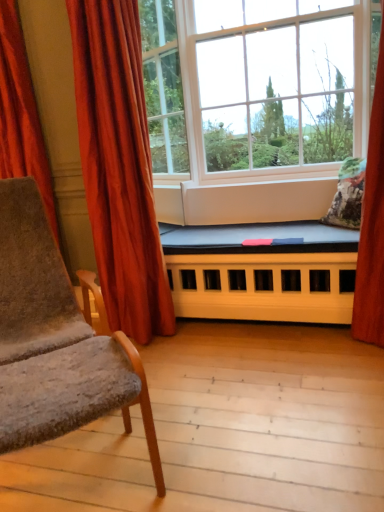
This screenshot has height=512, width=384. What do you see at coordinates (55, 340) in the screenshot?
I see `velvet gray armchair at left` at bounding box center [55, 340].

What is the approximate height of black fabric bed at center?

black fabric bed at center is 20.23 inches tall.

At what (x,y) coordinates should I click in order to perform the action: click on white plastic window at center, placed as the first window when sorted from right to left. Please return your answer as a coordinate pair (x, y). Looking at the image, I should click on click(256, 85).

Locate an element on the screen. The width and height of the screenshot is (384, 512). velvet gray armchair at left is located at coordinates (55, 340).

From the image's perspective, is velvet gray armchair at left above or below clear glass window at center, marked as the 1th window in a left-to-right arrangement?

velvet gray armchair at left is situated lower than clear glass window at center, marked as the 1th window in a left-to-right arrangement, in the image.

Is clear glass window at center, marked as the 2th window in a right-to-left arrangement, located within velvet gray armchair at left?

No, clear glass window at center, marked as the 2th window in a right-to-left arrangement, is not surrounded by velvet gray armchair at left.

Could you tell me if velvet gray armchair at left is facing clear glass window at center, marked as the 2th window in a right-to-left arrangement?

No, velvet gray armchair at left does not turn towards clear glass window at center, marked as the 2th window in a right-to-left arrangement.

From a real-world perspective, is velvet gray armchair at left positioned above or below clear glass window at center, marked as the 2th window in a right-to-left arrangement?

From a real-world perspective, velvet gray armchair at left is physically below clear glass window at center, marked as the 2th window in a right-to-left arrangement.

From a real-world perspective, who is located lower, fluffy floral pillow at right or velvet red curtain at left, which is counted as the first curtain, starting from the right?

fluffy floral pillow at right.

From the image's perspective, is fluffy floral pillow at right under velvet red curtain at left, which is counted as the first curtain, starting from the right?

Yes, from the image's perspective, fluffy floral pillow at right is below velvet red curtain at left, which is counted as the first curtain, starting from the right.

Between fluffy floral pillow at right and velvet red curtain at left, the second curtain in the left-to-right sequence, which one appears on the right side from the viewer's perspective?

fluffy floral pillow at right is more to the right.

Between fluffy floral pillow at right and velvet red curtain at left, which is counted as the first curtain, starting from the right, which one has smaller size?

fluffy floral pillow at right.

Which of these two, clear glass window at center, marked as the 2th window in a right-to-left arrangement, or white plastic window at center, placed as the first window when sorted from right to left, stands shorter?

clear glass window at center, marked as the 2th window in a right-to-left arrangement, is shorter.

Looking at this image, which object is further away from the camera taking this photo, clear glass window at center, marked as the 2th window in a right-to-left arrangement, or white plastic window at center, the second window in the left-to-right sequence?

clear glass window at center, marked as the 2th window in a right-to-left arrangement, is behind.

Which object is closer to the camera, white plastic window at center, placed as the first window when sorted from right to left, or velvet gray armchair at left?

velvet gray armchair at left.

From a real-world perspective, which is physically above, white plastic window at center, placed as the first window when sorted from right to left, or velvet gray armchair at left?

white plastic window at center, placed as the first window when sorted from right to left, from a real-world perspective.

Which is less distant, (148, 10) or (44, 426)?

Point (148, 10).

Based on the photo, does white plastic window at center, the second window in the left-to-right sequence, have a smaller size compared to velvet gray armchair at left?

Incorrect, white plastic window at center, the second window in the left-to-right sequence, is not smaller in size than velvet gray armchair at left.

Considering the relative sizes of white plastic window at center, the second window in the left-to-right sequence, and clear glass window at center, marked as the 1th window in a left-to-right arrangement, in the image provided, is white plastic window at center, the second window in the left-to-right sequence, thinner than clear glass window at center, marked as the 1th window in a left-to-right arrangement,?

Incorrect, the width of white plastic window at center, the second window in the left-to-right sequence, is not less than that of clear glass window at center, marked as the 1th window in a left-to-right arrangement.

From a real-world perspective, who is located lower, white plastic window at center, placed as the first window when sorted from right to left, or clear glass window at center, marked as the 1th window in a left-to-right arrangement?

From a 3D spatial view, white plastic window at center, placed as the first window when sorted from right to left, is below.

This screenshot has width=384, height=512. Identify the location of window that is below the clear glass window at center, marked as the 1th window in a left-to-right arrangement (from the image's perspective). (256, 85).

Is velvet red curtain at left, which is counted as the first curtain, starting from the right, positioned far away from fluffy floral pillow at right?

Indeed, velvet red curtain at left, which is counted as the first curtain, starting from the right, is not near fluffy floral pillow at right.

Is velvet red curtain at left, the second curtain in the left-to-right sequence, oriented towards fluffy floral pillow at right?

No.

Can you tell me how much velvet red curtain at left, which is counted as the first curtain, starting from the right, and fluffy floral pillow at right differ in facing direction?

They differ by 96.4 degrees in their facing directions.

Is point (129, 267) positioned before point (360, 161)?

Yes, it is.

Which of these two, fluffy floral pillow at right or clear glass window at center, marked as the 2th window in a right-to-left arrangement, is thinner?

clear glass window at center, marked as the 2th window in a right-to-left arrangement.

Between fluffy floral pillow at right and clear glass window at center, marked as the 2th window in a right-to-left arrangement, which one has less height?

fluffy floral pillow at right is shorter.

How different are the orientations of fluffy floral pillow at right and clear glass window at center, marked as the 2th window in a right-to-left arrangement, in degrees?

167 degrees.

Relative to clear glass window at center, marked as the 1th window in a left-to-right arrangement, is fluffy floral pillow at right in front or behind?

fluffy floral pillow at right is positioned closer to the viewer than clear glass window at center, marked as the 1th window in a left-to-right arrangement.

Find the location of a particular element. The width and height of the screenshot is (384, 512). window that is the 2nd one above the velvet gray armchair at left (from a real-world perspective) is located at coordinates (163, 87).

Identify the location of pillow directly beneath the velvet red curtain at left, the second curtain in the left-to-right sequence (from a real-world perspective). This screenshot has height=512, width=384. (348, 195).

Looking at the image, which one is located further to velvet gray armchair at left, velvet red curtain at left, the second curtain in the left-to-right sequence, or velvet red curtain at left, which is counted as the 1th curtain, starting from the left?

velvet red curtain at left, which is counted as the 1th curtain, starting from the left.

When comparing their distances from clear glass window at center, marked as the 1th window in a left-to-right arrangement, does white plastic window at center, placed as the first window when sorted from right to left, or velvet gray armchair at left seem further?

velvet gray armchair at left is positioned further to the anchor clear glass window at center, marked as the 1th window in a left-to-right arrangement.

When comparing their distances from velvet gray armchair at left, does fluffy floral pillow at right or white plastic window at center, placed as the first window when sorted from right to left, seem closer?

fluffy floral pillow at right.

Considering their positions, is velvet red curtain at left, which is counted as the first curtain, starting from the right, positioned further to velvet gray armchair at left than fluffy floral pillow at right?

Based on the image, fluffy floral pillow at right appears to be further to velvet gray armchair at left.

Considering their positions, is velvet red curtain at left, placed as the 2th curtain when sorted from right to left, positioned further to white plastic window at center, placed as the first window when sorted from right to left, than black fabric bed at center?

velvet red curtain at left, placed as the 2th curtain when sorted from right to left, is positioned further to the anchor white plastic window at center, placed as the first window when sorted from right to left.

Which object lies nearer to the anchor point velvet red curtain at left, placed as the 2th curtain when sorted from right to left, white plastic window at center, placed as the first window when sorted from right to left, or clear glass window at center, marked as the 2th window in a right-to-left arrangement?

The object closer to velvet red curtain at left, placed as the 2th curtain when sorted from right to left, is clear glass window at center, marked as the 2th window in a right-to-left arrangement.

From the picture: Based on their spatial positions, is velvet gray armchair at left or white plastic window at center, placed as the first window when sorted from right to left, further from velvet red curtain at left, the second curtain in the left-to-right sequence?

white plastic window at center, placed as the first window when sorted from right to left, lies further to velvet red curtain at left, the second curtain in the left-to-right sequence, than the other object.

When comparing their distances from velvet red curtain at left, which is counted as the first curtain, starting from the right, does white plastic window at center, placed as the first window when sorted from right to left, or fluffy floral pillow at right seem further?

The object further to velvet red curtain at left, which is counted as the first curtain, starting from the right, is fluffy floral pillow at right.

The height and width of the screenshot is (512, 384). Find the location of `curtain between velvet red curtain at left, placed as the 2th curtain when sorted from right to left, and black fabric bed at center`. curtain between velvet red curtain at left, placed as the 2th curtain when sorted from right to left, and black fabric bed at center is located at coordinates (119, 166).

Find the location of a particular element. pillow between white plastic window at center, the second window in the left-to-right sequence, and black fabric bed at center, in the vertical direction is located at coordinates (348, 195).

At what (x,y) coordinates should I click in order to perform the action: click on curtain located between velvet gray armchair at left and white plastic window at center, placed as the first window when sorted from right to left, in the left-right direction. Please return your answer as a coordinate pair (x, y). Looking at the image, I should click on (119, 166).

At what (x,y) coordinates should I click in order to perform the action: click on bed situated between velvet red curtain at left, which is counted as the first curtain, starting from the right, and fluffy floral pillow at right from left to right. Please return your answer as a coordinate pair (x, y). The height and width of the screenshot is (512, 384). Looking at the image, I should click on (262, 272).